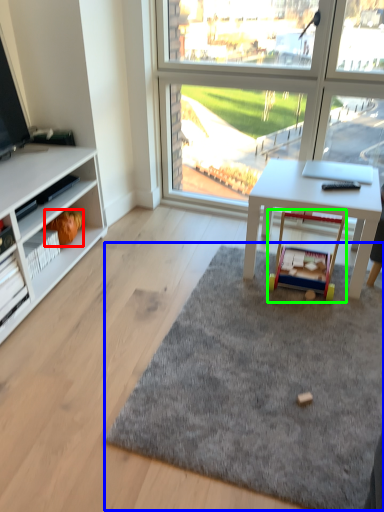
Question: Which object is the closest to the toy (highlighted by a red box)? Choose among these: mat (highlighted by a blue box) or toy (highlighted by a green box).

Choices:
 (A) mat
 (B) toy

Answer: (B)